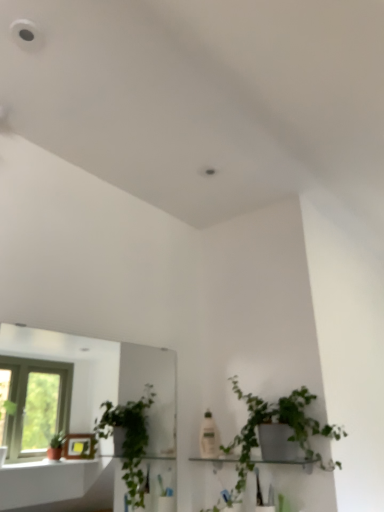
Question: Should I look upward or downward to see clear glass mirror at left?

Choices:
 (A) down
 (B) up

Answer: (A)

Question: From a real-world perspective, is white glossy shelf at center on clear glass mirror at left?

Choices:
 (A) no
 (B) yes

Answer: (A)

Question: Does white glossy shelf at center have a smaller size compared to clear glass mirror at left?

Choices:
 (A) no
 (B) yes

Answer: (B)

Question: Is white glossy shelf at center bigger than clear glass mirror at left?

Choices:
 (A) yes
 (B) no

Answer: (B)

Question: Does white glossy shelf at center have a lesser height compared to clear glass mirror at left?

Choices:
 (A) no
 (B) yes

Answer: (B)

Question: Is white glossy shelf at center not inside clear glass mirror at left?

Choices:
 (A) yes
 (B) no

Answer: (A)

Question: From the image's perspective, is white glossy shelf at center over clear glass mirror at left?

Choices:
 (A) no
 (B) yes

Answer: (A)

Question: Is green matte plant at center-right looking in the opposite direction of clear glass mirror at left?

Choices:
 (A) yes
 (B) no

Answer: (B)

Question: Considering the relative sizes of green matte plant at center-right and clear glass mirror at left in the image provided, is green matte plant at center-right thinner than clear glass mirror at left?

Choices:
 (A) no
 (B) yes

Answer: (A)

Question: Considering the relative sizes of green matte plant at center-right and clear glass mirror at left in the image provided, is green matte plant at center-right smaller than clear glass mirror at left?

Choices:
 (A) yes
 (B) no

Answer: (B)

Question: From the image's perspective, would you say green matte plant at center-right is positioned over clear glass mirror at left?

Choices:
 (A) no
 (B) yes

Answer: (A)

Question: Considering the relative sizes of green matte plant at center-right and clear glass mirror at left in the image provided, is green matte plant at center-right taller than clear glass mirror at left?

Choices:
 (A) yes
 (B) no

Answer: (B)

Question: Is green matte plant at center-right to the right of clear glass mirror at left from the viewer's perspective?

Choices:
 (A) yes
 (B) no

Answer: (A)

Question: Is clear glass mirror at left further to the viewer compared to green matte plant at center-right?

Choices:
 (A) no
 (B) yes

Answer: (A)